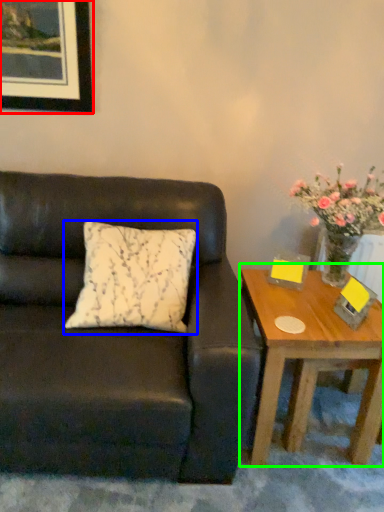
Question: Which object is positioned farthest from picture frame (highlighted by a red box)? Select from pillow (highlighted by a blue box) and coffee table (highlighted by a green box).

Choices:
 (A) pillow
 (B) coffee table

Answer: (B)